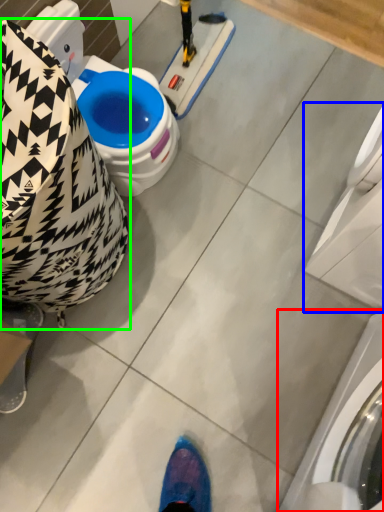
Question: Which object is positioned closest to washing machine (highlighted by a red box)? Select from washing machine (highlighted by a blue box) and bean bag chair (highlighted by a green box).

Choices:
 (A) washing machine
 (B) bean bag chair

Answer: (A)